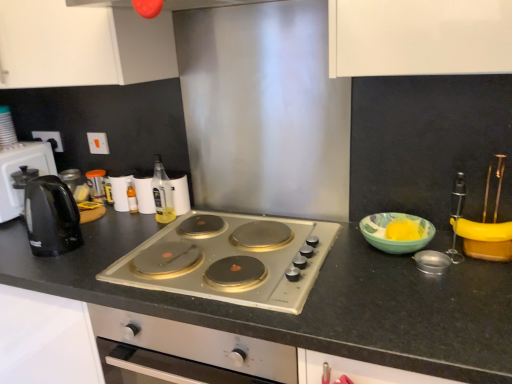
I want to click on free space in front of matte green bowl at right, so click(418, 280).